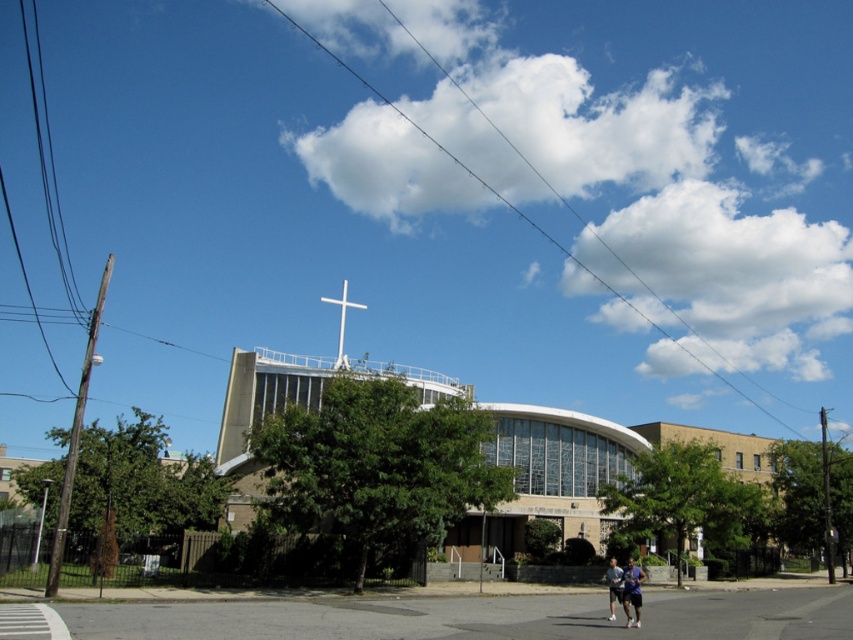
Question: Can you confirm if matte blue shorts at lower right is positioned to the right of white metallic cross at upper center?

Choices:
 (A) no
 (B) yes

Answer: (B)

Question: Does matte blue shorts at lower right appear on the left side of white metallic cross at upper center?

Choices:
 (A) no
 (B) yes

Answer: (A)

Question: Considering the relative positions of matte blue shorts at lower right and white metallic cross at upper center in the image provided, where is matte blue shorts at lower right located with respect to white metallic cross at upper center?

Choices:
 (A) left
 (B) right

Answer: (B)

Question: Which of the following is the farthest from the observer?

Choices:
 (A) matte blue shorts at lower right
 (B) white metallic cross at upper center

Answer: (B)

Question: Which point is farther to the camera?

Choices:
 (A) white metallic cross at upper center
 (B) matte blue shorts at lower right

Answer: (A)